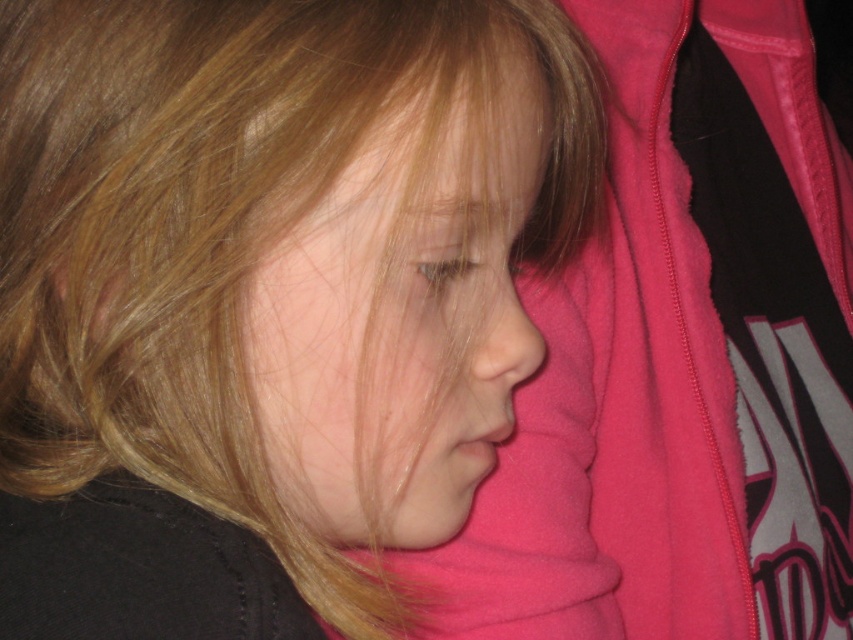
Between blonde smooth hair at center and smooth skin face at center, which one has less height?

Standing shorter between the two is smooth skin face at center.

Between point (123, 81) and point (490, 122), which one is positioned behind?

Positioned behind is point (490, 122).

What do you see at coordinates (265, 294) in the screenshot?
I see `blonde smooth hair at center` at bounding box center [265, 294].

In order to click on blonde smooth hair at center in this screenshot , I will do `click(265, 294)`.